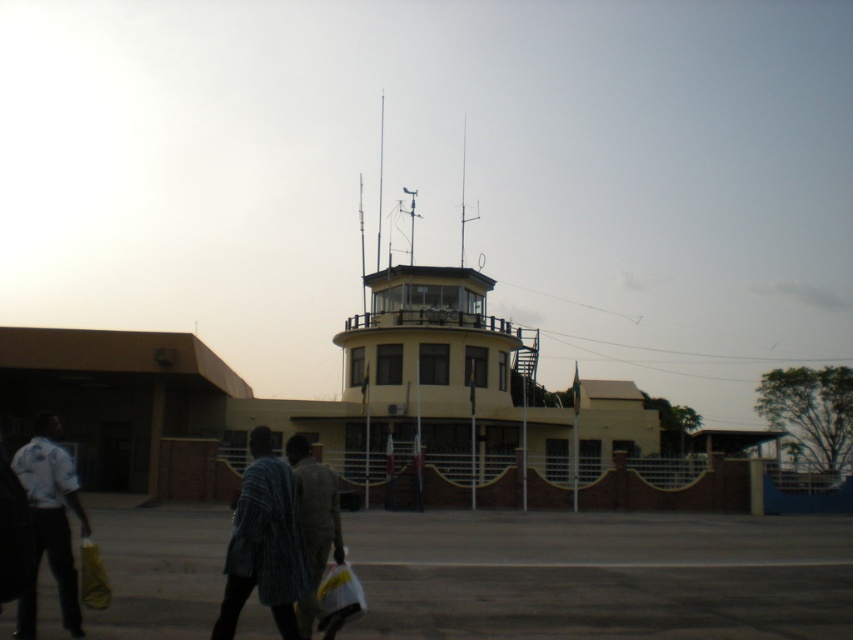
Based on the photo, can you confirm if striped fabric couple at center is positioned to the left of light brown fabric jacket at center?

Correct, you'll find striped fabric couple at center to the left of light brown fabric jacket at center.

Is striped fabric couple at center to the right of light brown fabric jacket at center from the viewer's perspective?

Incorrect, striped fabric couple at center is not on the right side of light brown fabric jacket at center.

The image size is (853, 640). Identify the location of striped fabric couple at center. 279,536.

Is point (32, 449) positioned in front of point (316, 472)?

No, (32, 449) is behind (316, 472).

This screenshot has height=640, width=853. I want to click on white uniform at left, so click(x=49, y=522).

This screenshot has width=853, height=640. What are the coordinates of `white uniform at left` in the screenshot? It's located at point(49,522).

Who is lower down, striped fabric couple at center or white uniform at left?

striped fabric couple at center

Is striped fabric couple at center bigger than white uniform at left?

Correct, striped fabric couple at center is larger in size than white uniform at left.

Does point (317, 564) come farther from viewer compared to point (59, 449)?

That is False.

I want to click on striped fabric couple at center, so click(279, 536).